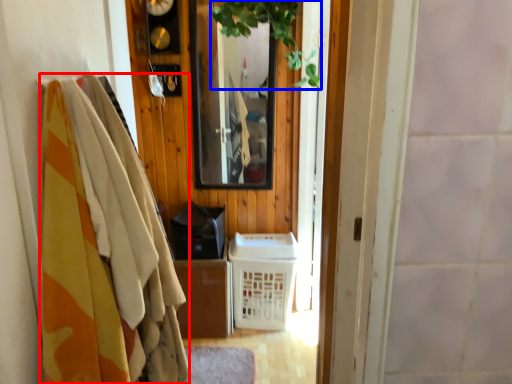
Question: Among these objects, which one is nearest to the camera, clothing (highlighted by a red box) or plant (highlighted by a blue box)?

Choices:
 (A) clothing
 (B) plant

Answer: (A)